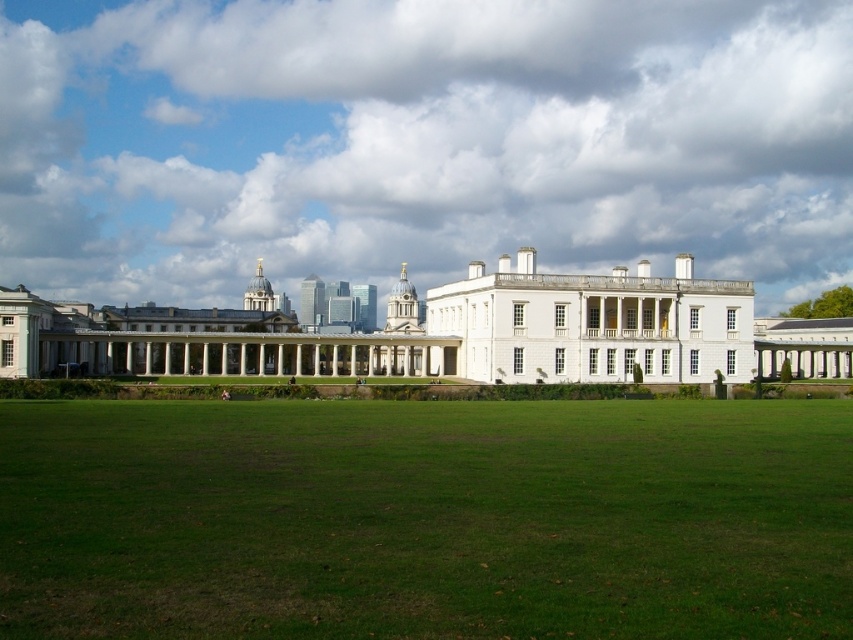
You are a landscape architect designing a garden for the white glossy mansion at center. Based on the scene, where is the green grass at center situated in relation to the mansion?

The green grass at center is located below the white glossy mansion at center, so it is positioned at the base of the mansion, forming a lawn area in front or around the structure.